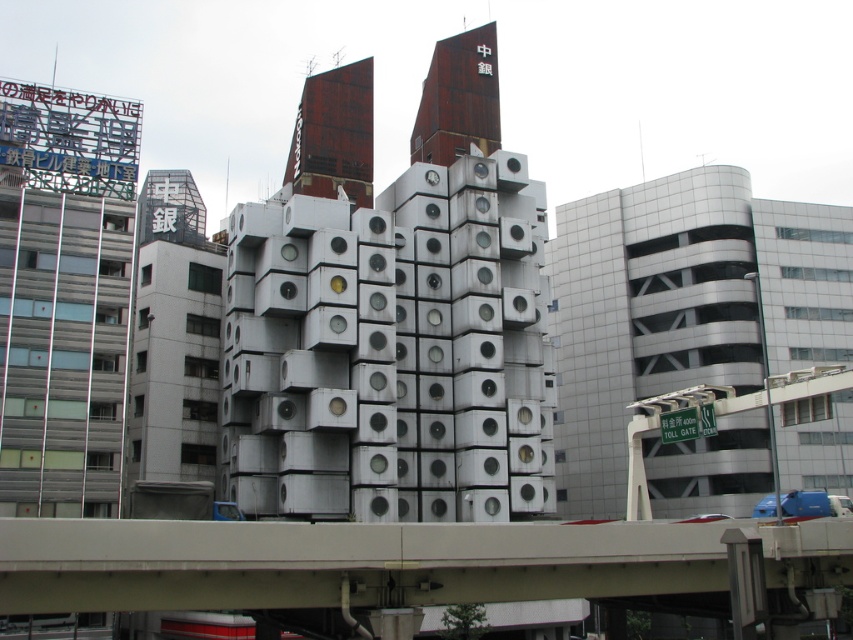
You are a city planner reviewing the urban layout. You need to determine which structure occupies more space in the foreground. Which one is larger between the concrete bridge at center and the gray concrete building at left?

The concrete bridge at center is bigger than the gray concrete building at left, so the concrete bridge at center occupies more space in the foreground.

Please provide the coordinates of the concrete bridge at center in the image. The coordinate system is normalized, with the origin at the bottom left corner of the image, and the values range from 0 to 1 in both x and y axes.

The concrete bridge at center is located at coordinates point (346, 563).

You are a city planner reviewing the urban layout. You need to determine the spatial relationship between the concrete bridge at center and the rustic wood tower at upper center. Which object is located to the right of the other?

The concrete bridge at center is positioned on the right side of rustic wood tower at upper center, so the concrete bridge at center is to the right of the rustic wood tower at upper center.